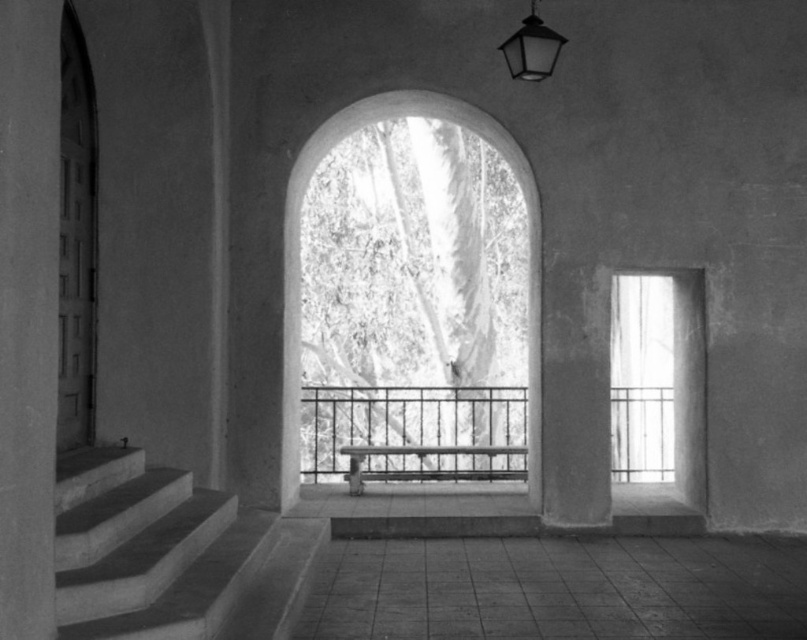
Question: Which object appears farthest from the camera in this image?

Choices:
 (A) smooth metal bench at center
 (B) clear glass window at right

Answer: (B)

Question: Can you confirm if smooth concrete pillar at left is thinner than translucent glass bench at center?

Choices:
 (A) no
 (B) yes

Answer: (B)

Question: Which of the following is the farthest from the observer?

Choices:
 (A) smooth concrete stairs at lower left
 (B) translucent glass bench at center
 (C) matte black lantern at upper center

Answer: (B)

Question: Does translucent glass bench at center appear over smooth metal bench at center?

Choices:
 (A) yes
 (B) no

Answer: (A)

Question: Estimate the real-world distances between objects in this image. Which object is closer to the translucent glass bench at center?

Choices:
 (A) smooth metal bench at center
 (B) clear glass window at right
 (C) smooth concrete pillar at left

Answer: (A)

Question: Can you confirm if metallic black balustrade at center is bigger than translucent glass bench at center?

Choices:
 (A) no
 (B) yes

Answer: (B)